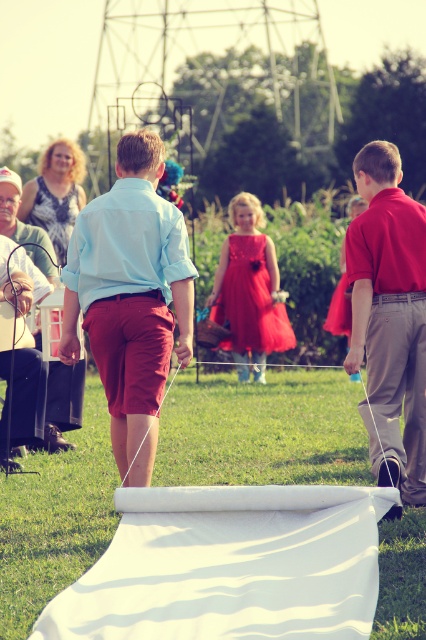
Question: Where is white string at center located in relation to shiny taffeta dress at center in the image?

Choices:
 (A) below
 (B) above

Answer: (A)

Question: Which point is farther from the camera taking this photo?

Choices:
 (A) (365, 180)
 (B) (218, 320)
 (C) (166, 310)

Answer: (B)

Question: Which object appears closest to the camera in this image?

Choices:
 (A) light blue cotton shirt at center
 (B) matte red shirt at right

Answer: (A)

Question: Among these points, which one is nearest to the camera?

Choices:
 (A) (371, 280)
 (B) (324, 372)
 (C) (270, 323)

Answer: (A)

Question: Is matte red shirt at right closer to camera compared to shiny taffeta dress at center?

Choices:
 (A) yes
 (B) no

Answer: (A)

Question: Does white string at center appear on the right side of shiny taffeta dress at center?

Choices:
 (A) yes
 (B) no

Answer: (A)